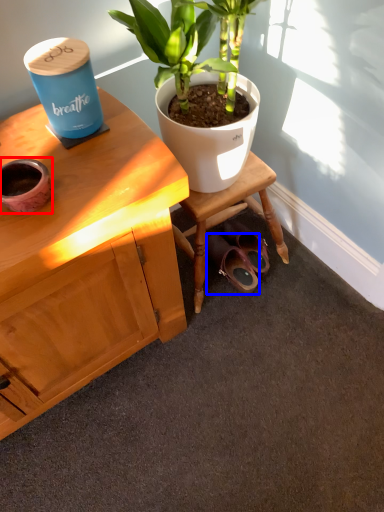
Question: Which point is further to the camera, flowerpot (highlighted by a red box) or footwear (highlighted by a blue box)?

Choices:
 (A) flowerpot
 (B) footwear

Answer: (B)